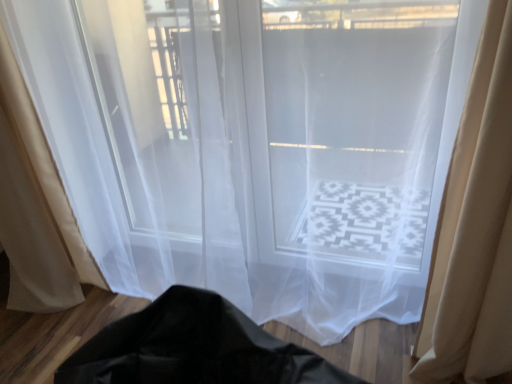
I want to click on vacant space in front of beige sheer curtain at left, positioned as the second curtain in right-to-left order, so click(x=53, y=338).